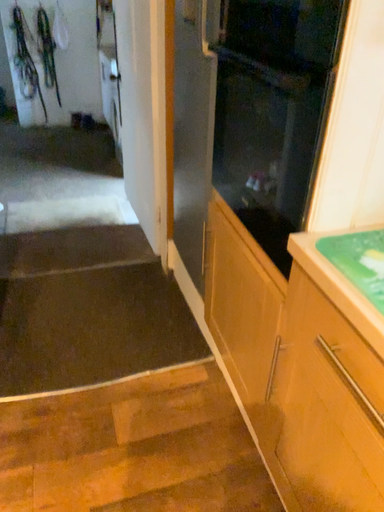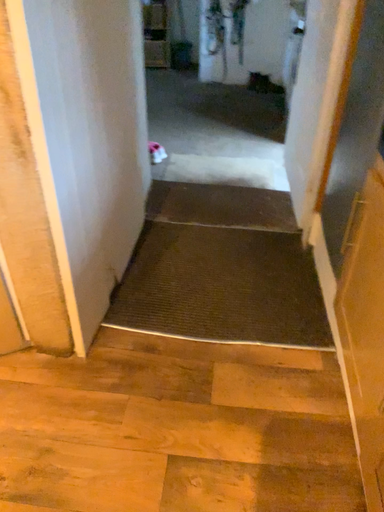
Question: How did the camera likely rotate when shooting the video?

Choices:
 (A) rotated left
 (B) rotated right

Answer: (A)